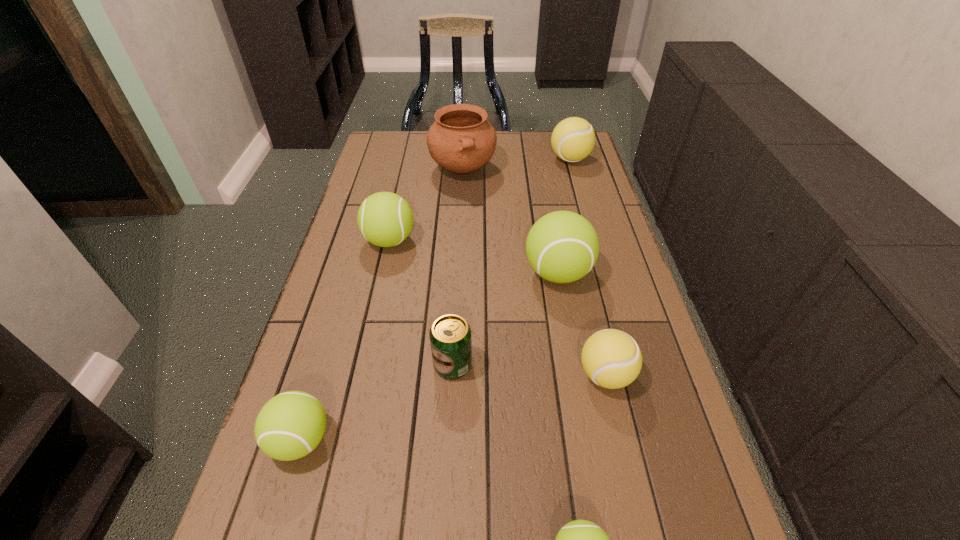
Where is `tennis ball that is the fourth closest to the nearest green tennis ball`? The height and width of the screenshot is (540, 960). tennis ball that is the fourth closest to the nearest green tennis ball is located at coordinates (385, 219).

Identify the location of green tennis ball that is the closest to the second biggest green tennis ball. (562, 246).

Image resolution: width=960 pixels, height=540 pixels. I want to click on green tennis ball that can be found as the third closest to the fourth farthest tennis ball, so click(290, 425).

The image size is (960, 540). I want to click on yellow tennis ball that is the second closest one to the green beer can, so click(x=573, y=139).

Identify which yellow tennis ball is the nearest to the shortest tennis ball. Please provide its 2D coordinates. Your answer should be formatted as a tuple, i.e. [(x, y)], where the tuple contains the x and y coordinates of a point satisfying the conditions above.

[(612, 359)]

At what (x,y) coordinates should I click in order to perform the action: click on vacant region that satisfies the following two spatial constraints: 1. on the back side of the beer can; 2. on the left side of the third biggest green tennis ball. Please return your answer as a coordinate pair (x, y). Looking at the image, I should click on (323, 364).